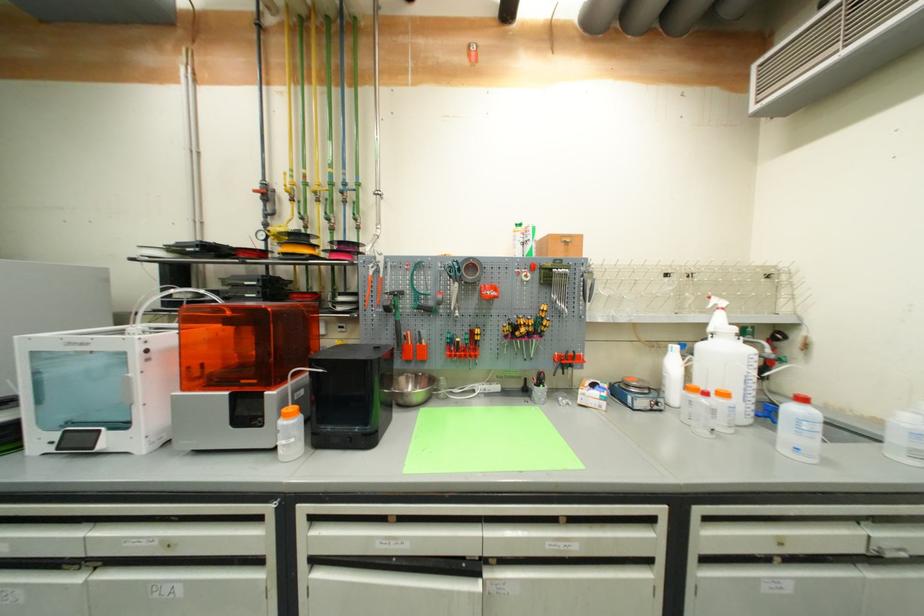
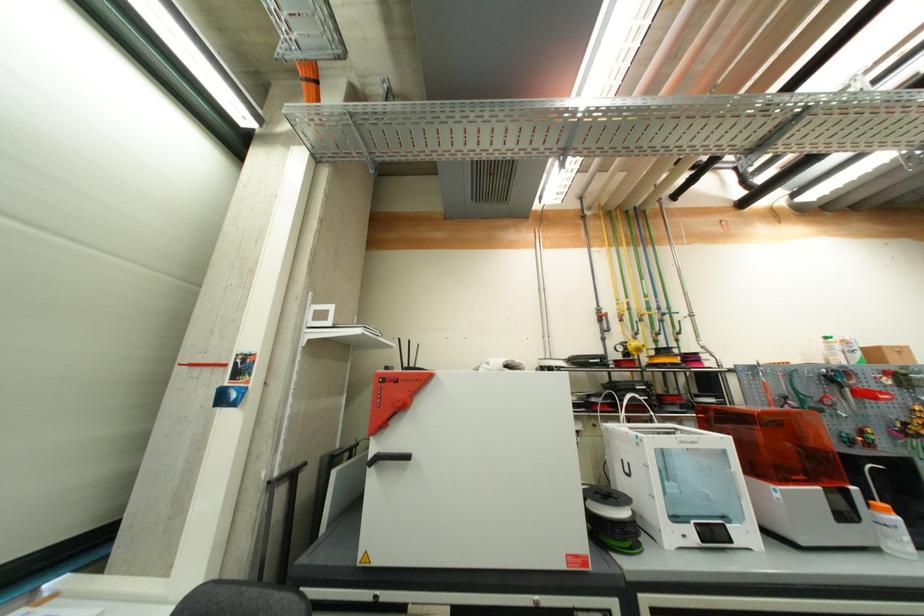
Question: What movement of the cameraman would produce the second image?

Choices:
 (A) Left
 (B) Right
 (C) Forward
 (D) Backward

Answer: (A)